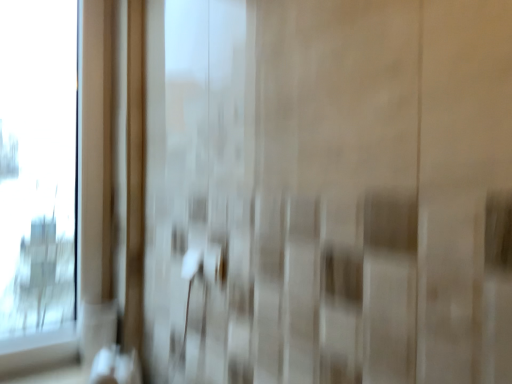
What is the approximate height of white plastic door handle at center?

It is 8.85 centimeters.

What do you see at coordinates (205, 262) in the screenshot? I see `white plastic door handle at center` at bounding box center [205, 262].

In order to click on white plastic door handle at center in this screenshot , I will do `click(205, 262)`.

This screenshot has height=384, width=512. What do you see at coordinates (38, 165) in the screenshot? I see `transparent glass window at left` at bounding box center [38, 165].

The image size is (512, 384). What are the coordinates of `transparent glass window at left` in the screenshot? It's located at (38, 165).

The width and height of the screenshot is (512, 384). I want to click on white plastic door handle at center, so click(x=205, y=262).

Does white plastic door handle at center appear on the left side of transparent glass window at left?

Incorrect, white plastic door handle at center is not on the left side of transparent glass window at left.

Does white plastic door handle at center come in front of transparent glass window at left?

Yes, white plastic door handle at center is closer to the camera.

From the picture: Which point is more distant from viewer, (206, 269) or (22, 189)?

The point (22, 189) is farther.

From the image's perspective, is white plastic door handle at center over transparent glass window at left?

No, from the image's perspective, white plastic door handle at center is not above transparent glass window at left.

From a real-world perspective, who is located higher, white plastic door handle at center or transparent glass window at left?

transparent glass window at left is physically above.

Is white plastic door handle at center wider than transparent glass window at left?

In fact, white plastic door handle at center might be narrower than transparent glass window at left.

Consider the image. Is white plastic door handle at center taller than transparent glass window at left?

Incorrect, the height of white plastic door handle at center is not larger of that of transparent glass window at left.

Considering the relative sizes of white plastic door handle at center and transparent glass window at left in the image provided, is white plastic door handle at center smaller than transparent glass window at left?

Correct, white plastic door handle at center occupies less space than transparent glass window at left.

Is white plastic door handle at center not within transparent glass window at left?

Yes, white plastic door handle at center is not within transparent glass window at left.

Is there a large distance between white plastic door handle at center and transparent glass window at left?

white plastic door handle at center is near transparent glass window at left, not far away.

Based on the photo, is white plastic door handle at center facing away from transparent glass window at left?

That's not correct — white plastic door handle at center is not looking away from transparent glass window at left.

How many degrees apart are the facing directions of white plastic door handle at center and transparent glass window at left?

The facing directions of white plastic door handle at center and transparent glass window at left are 89.8 degrees apart.

How much distance is there between white plastic door handle at center and transparent glass window at left?

They are 31.92 inches apart.

The width and height of the screenshot is (512, 384). Identify the location of door handle that is under the transparent glass window at left (from a real-world perspective). (205, 262).

Is transparent glass window at left at the left side of white plastic door handle at center?

Correct, you'll find transparent glass window at left to the left of white plastic door handle at center.

Which is behind, transparent glass window at left or white plastic door handle at center?

transparent glass window at left is further from the camera.

Is point (14, 229) closer or farther from the camera than point (183, 270)?

Point (14, 229).

From the image's perspective, which is above, transparent glass window at left or white plastic door handle at center?

transparent glass window at left appears higher in the image.

From a real-world perspective, which object rests below the other?

white plastic door handle at center, from a real-world perspective.

Considering the sizes of objects transparent glass window at left and white plastic door handle at center in the image provided, who is wider, transparent glass window at left or white plastic door handle at center?

Wider between the two is transparent glass window at left.

Between transparent glass window at left and white plastic door handle at center, which one has less height?

With less height is white plastic door handle at center.

From the picture: Is transparent glass window at left smaller than white plastic door handle at center?

No.

Is white plastic door handle at center located within transparent glass window at left?

No, white plastic door handle at center is located outside of transparent glass window at left.

Is transparent glass window at left positioned far away from white plastic door handle at center?

No, there isn't a large distance between transparent glass window at left and white plastic door handle at center.

Is transparent glass window at left turned away from white plastic door handle at center?

No.

What's the angular difference between transparent glass window at left and white plastic door handle at center's facing directions?

The angular difference between transparent glass window at left and white plastic door handle at center is 89.8 degrees.

How much distance is there between transparent glass window at left and white plastic door handle at center?

31.92 inches.

You are a GUI agent. You are given a task and a screenshot of the screen. Output one action in this format:
    pyautogui.click(x=<x>, y=<y>)
    Task: Click on the window above the white plastic door handle at center (from the image's perspective)
    This screenshot has height=384, width=512.
    Given the screenshot: What is the action you would take?
    pyautogui.click(x=38, y=165)

The image size is (512, 384). Identify the location of window behind the white plastic door handle at center. (38, 165).

At what (x,y) coordinates should I click in order to perform the action: click on door handle that is under the transparent glass window at left (from a real-world perspective). Please return your answer as a coordinate pair (x, y). The height and width of the screenshot is (384, 512). Looking at the image, I should click on [205, 262].